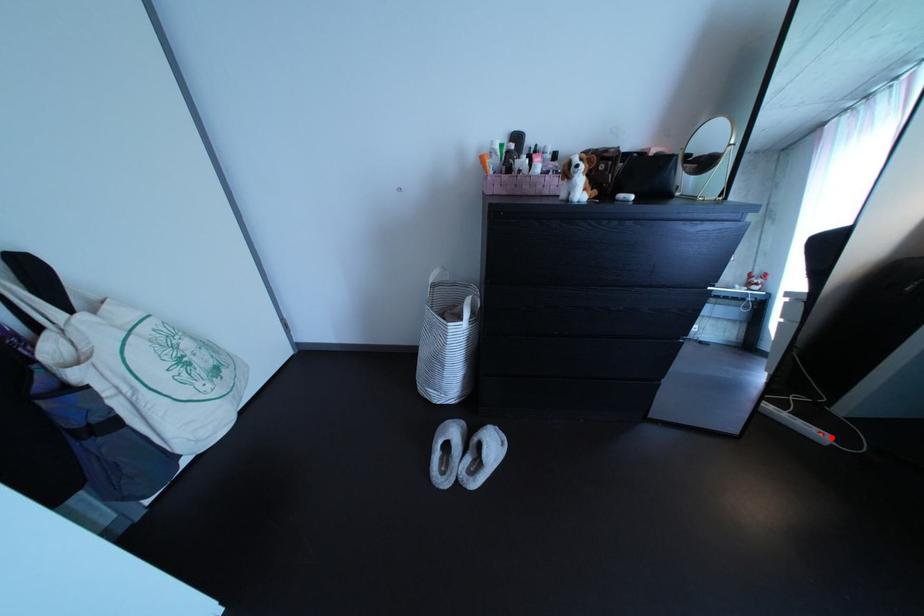
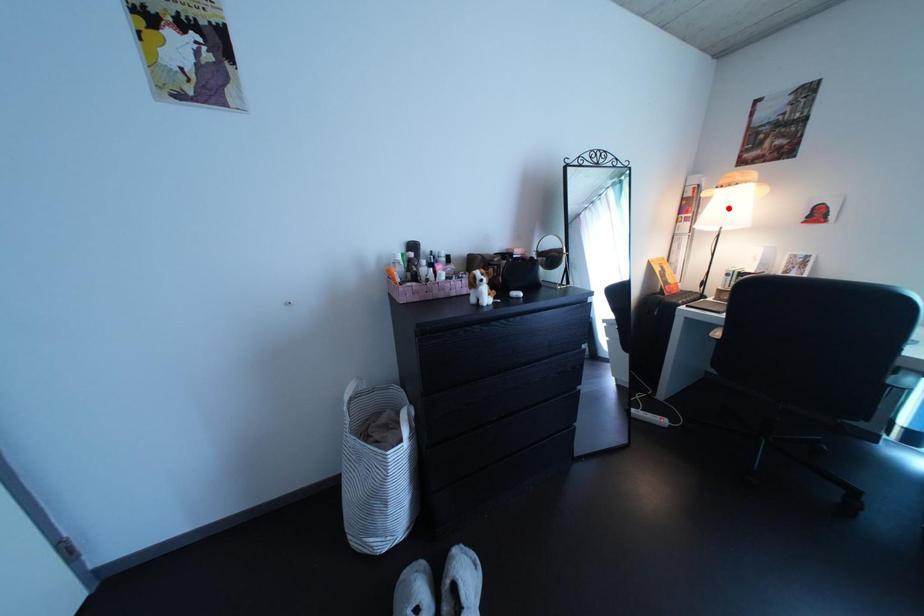
I am providing you with two images of the same scene from different viewpoints. A red point is marked on the first image and another point is marked on the second image. Do the highlighted points in image1 and image2 indicate the same real-world spot?

No